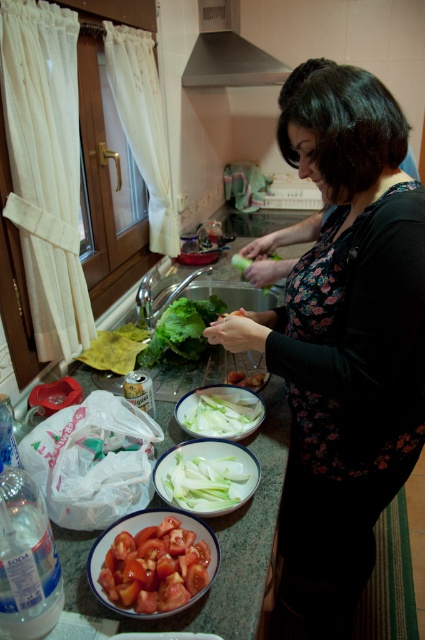
Is white glossy platter at center wider than green leafy lettuce at center?

In fact, white glossy platter at center might be narrower than green leafy lettuce at center.

Does white glossy platter at center appear on the left side of green leafy lettuce at center?

In fact, white glossy platter at center is to the right of green leafy lettuce at center.

I want to click on white glossy platter at center, so click(x=220, y=412).

Can you confirm if floral-patterned fabric at center is positioned to the right of white glossy counter top at center?

Correct, you'll find floral-patterned fabric at center to the right of white glossy counter top at center.

Looking at this image, which is more to the left, floral-patterned fabric at center or white glossy counter top at center?

From the viewer's perspective, white glossy counter top at center appears more on the left side.

Is point (333, 582) closer to camera compared to point (266, 566)?

That is False.

What are the coordinates of `floral-patterned fabric at center` in the screenshot? It's located at (345, 337).

Is point (104, 588) more distant than point (214, 301)?

No.

Who is higher up, sliced matte tomato at lower left or green leafy lettuce at center?

green leafy lettuce at center is above.

Identify the location of sliced matte tomato at lower left. click(155, 566).